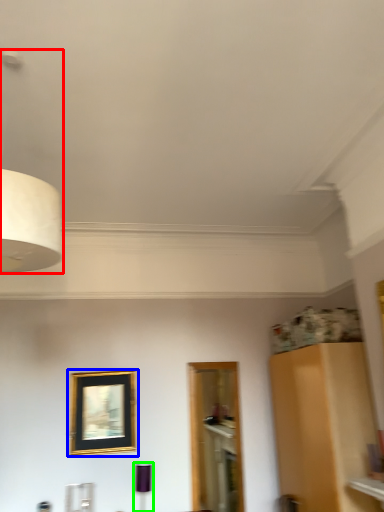
Question: Which object is the closest to the lamp (highlighted by a red box)? Choose among these: picture frame (highlighted by a blue box) or lamp (highlighted by a green box).

Choices:
 (A) picture frame
 (B) lamp

Answer: (A)